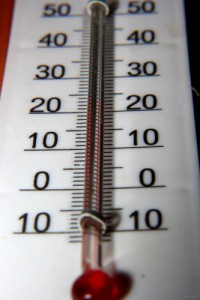
Find the location of a particular element. The height and width of the screenshot is (300, 200). glass is located at coordinates click(91, 273).